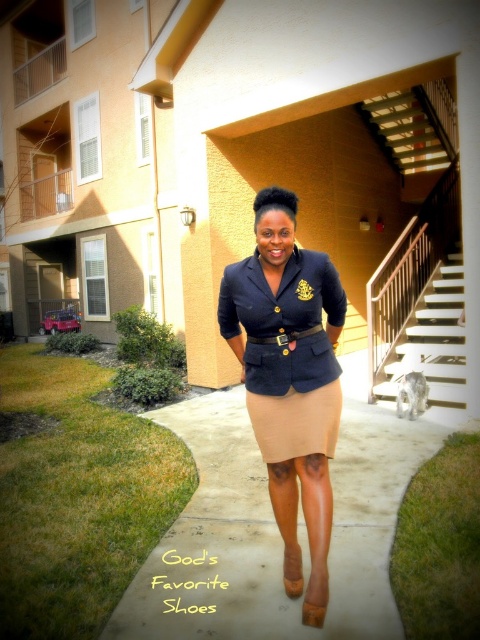
Question: Which object appears farthest from the camera in this image?

Choices:
 (A) suede skirt at center
 (B) white wooden stairs at right

Answer: (B)

Question: Which point is farther to the camera?

Choices:
 (A) white wooden stairs at right
 (B) matte black blazer at center
 (C) suede skirt at center
 (D) beige concrete pavement at center

Answer: (A)

Question: Does matte black blazer at center have a greater width compared to white wooden stairs at right?

Choices:
 (A) yes
 (B) no

Answer: (B)

Question: Can you confirm if matte black blazer at center is positioned to the left of suede skirt at center?

Choices:
 (A) yes
 (B) no

Answer: (B)

Question: Which is farther from the white wooden stairs at right?

Choices:
 (A) beige concrete pavement at center
 (B) matte black blazer at center
 (C) suede skirt at center
 (D) beige satin skirt at center

Answer: (D)

Question: From the image, what is the correct spatial relationship of matte black blazer at center in relation to suede skirt at center?

Choices:
 (A) right
 (B) left

Answer: (A)